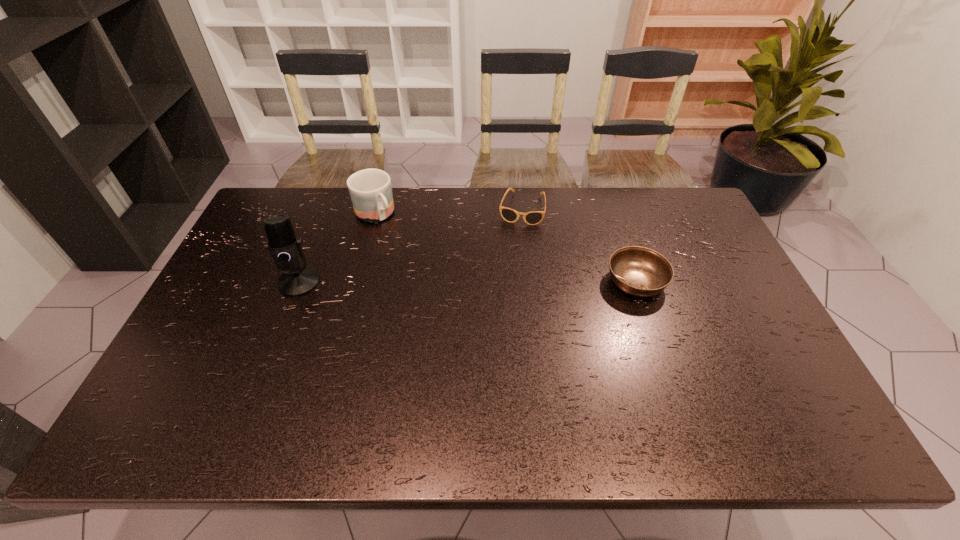
Locate an element on the screen. The width and height of the screenshot is (960, 540). vacant space on the desktop that is between the leftmost object and the soup bowl and is positioned on the side with the handle of the mug is located at coordinates (435, 282).

Find the location of a particular element. The image size is (960, 540). vacant space on the desktop that is between the microphone and the soup bowl and is positioned on the front-facing side of the sunglasses is located at coordinates (504, 282).